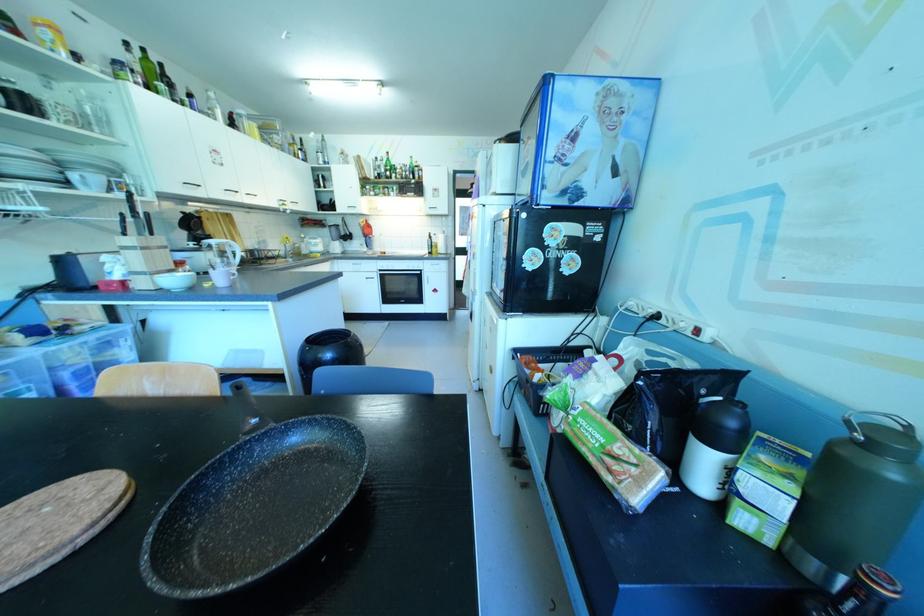
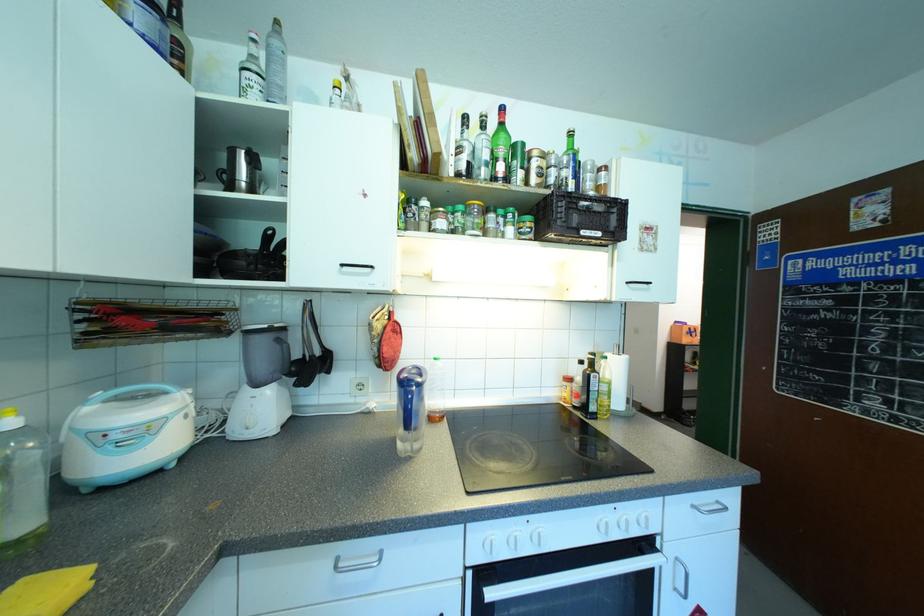
Where in the second image is the point corresponding to (x=335, y=246) from the first image?

(262, 410)